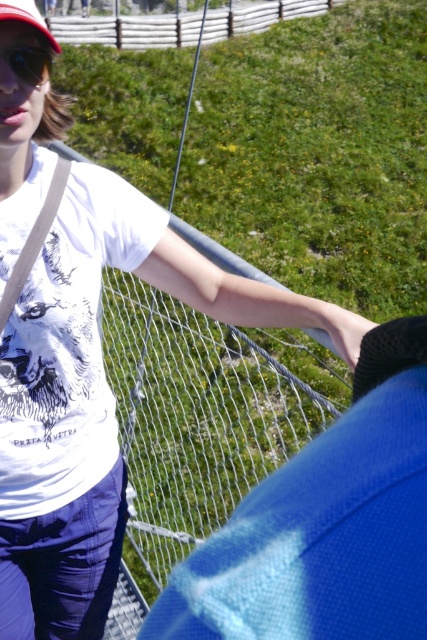
Question: Is matte black goggles at upper left closer to camera compared to matte red baseball cap at upper left?

Choices:
 (A) no
 (B) yes

Answer: (A)

Question: Where is matte black goggles at upper left located in relation to matte red baseball cap at upper left in the image?

Choices:
 (A) above
 (B) below

Answer: (B)

Question: Which point is farther to the camera?

Choices:
 (A) matte black goggles at upper left
 (B) matte red baseball cap at upper left

Answer: (A)

Question: Which of the following is the closest to the observer?

Choices:
 (A) matte black goggles at upper left
 (B) matte red baseball cap at upper left

Answer: (B)

Question: Observing the image, what is the correct spatial positioning of matte black goggles at upper left in reference to matte red baseball cap at upper left?

Choices:
 (A) above
 (B) below

Answer: (B)